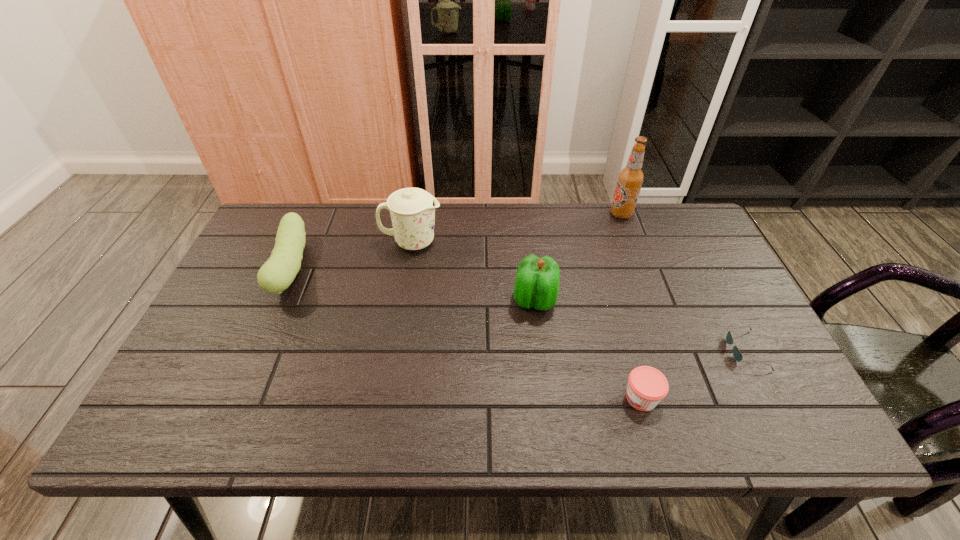
Locate an element on the screen. Image resolution: width=960 pixels, height=540 pixels. the farthest object is located at coordinates (630, 179).

I want to click on the tallest object, so point(630,179).

Image resolution: width=960 pixels, height=540 pixels. In order to click on chinaware in this screenshot , I will do `click(412, 210)`.

The image size is (960, 540). Identify the location of the second object from left to right. (412, 210).

Locate an element on the screen. This screenshot has width=960, height=540. the third object from left to right is located at coordinates (536, 285).

You are a GUI agent. You are given a task and a screenshot of the screen. Output one action in this format:
    pyautogui.click(x=<x>, y=<y>)
    Task: Click on the bell pepper
    The image size is (960, 540).
    Given the screenshot: What is the action you would take?
    pyautogui.click(x=536, y=285)

Identify the location of the leftmost object. The width and height of the screenshot is (960, 540). (279, 271).

Where is `the fourth tallest object`? This screenshot has width=960, height=540. the fourth tallest object is located at coordinates (279, 271).

You are a GUI agent. You are given a task and a screenshot of the screen. Output one action in this format:
    pyautogui.click(x=<x>, y=<y>)
    Task: Click on the fourth object from left to right
    The height and width of the screenshot is (540, 960).
    Given the screenshot: What is the action you would take?
    pyautogui.click(x=647, y=386)

Image resolution: width=960 pixels, height=540 pixels. In order to click on the nearest object in this screenshot , I will do `click(647, 386)`.